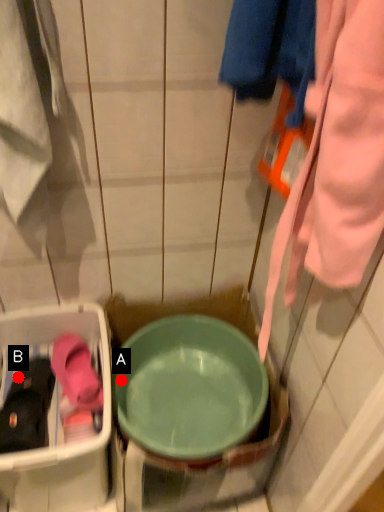
Question: Two points are circled on the image, labeled by A and B beside each circle. Which of the following is the farthest from the observer?

Choices:
 (A) A is further
 (B) B is further

Answer: (A)